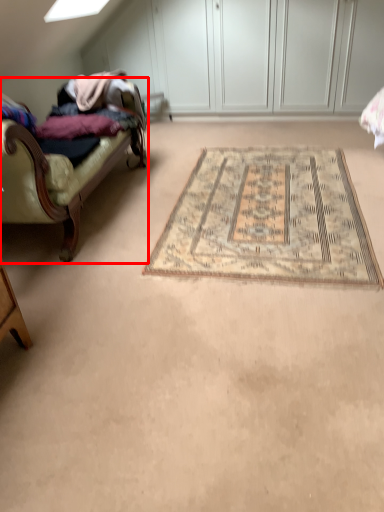
Question: Considering the relative positions of studio couch (annotated by the red box) and mat in the image provided, where is studio couch (annotated by the red box) located with respect to the staircase?

Choices:
 (A) left
 (B) right

Answer: (A)